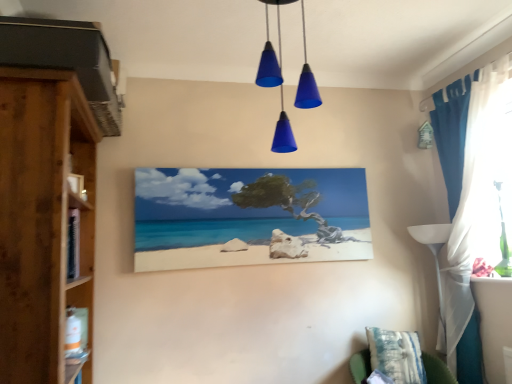
Question: Can you confirm if blue fabric curtain at right is wider than blue matte cone lights at center?

Choices:
 (A) yes
 (B) no

Answer: (B)

Question: Is the depth of blue fabric curtain at right greater than that of blue matte cone lights at center?

Choices:
 (A) yes
 (B) no

Answer: (A)

Question: From a real-world perspective, is blue fabric curtain at right over blue matte cone lights at center?

Choices:
 (A) no
 (B) yes

Answer: (A)

Question: Does blue fabric curtain at right have a greater height compared to blue matte cone lights at center?

Choices:
 (A) yes
 (B) no

Answer: (A)

Question: Is blue fabric curtain at right closer to the viewer compared to blue matte cone lights at center?

Choices:
 (A) yes
 (B) no

Answer: (B)

Question: Is blue fabric curtain at right at the left side of blue matte cone lights at center?

Choices:
 (A) no
 (B) yes

Answer: (A)

Question: From the image's perspective, is wooden cupboard at left beneath matte canvas painting at center?

Choices:
 (A) yes
 (B) no

Answer: (A)

Question: Is wooden cupboard at left oriented away from matte canvas painting at center?

Choices:
 (A) no
 (B) yes

Answer: (A)

Question: Does wooden cupboard at left appear on the left side of matte canvas painting at center?

Choices:
 (A) no
 (B) yes

Answer: (B)

Question: Would you say wooden cupboard at left is a long distance from matte canvas painting at center?

Choices:
 (A) yes
 (B) no

Answer: (B)

Question: Considering the relative positions of wooden cupboard at left and matte canvas painting at center in the image provided, is wooden cupboard at left to the right of matte canvas painting at center from the viewer's perspective?

Choices:
 (A) yes
 (B) no

Answer: (B)

Question: From a real-world perspective, is wooden cupboard at left physically above matte canvas painting at center?

Choices:
 (A) yes
 (B) no

Answer: (B)

Question: Is blue fabric curtain at right outside wooden cupboard at left?

Choices:
 (A) no
 (B) yes

Answer: (B)